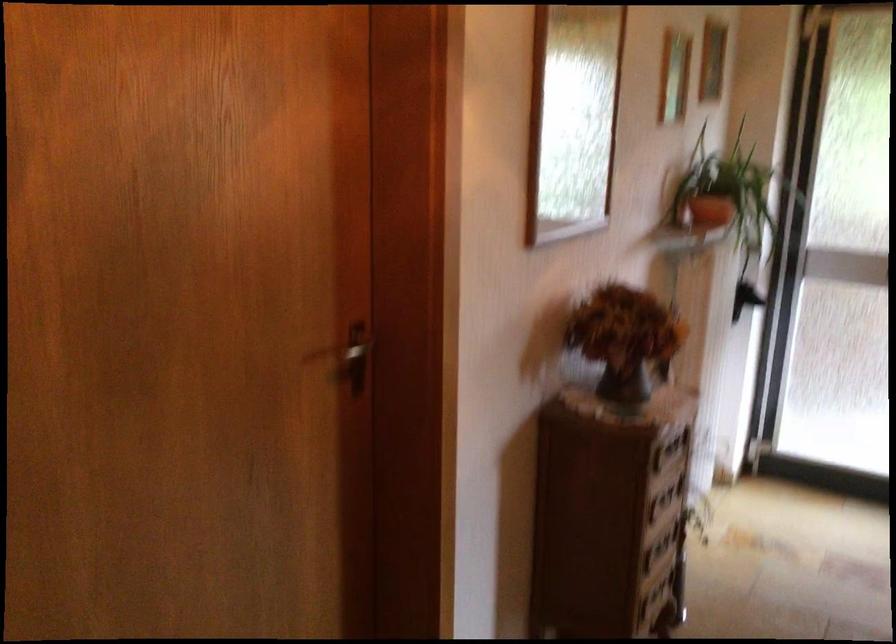
Image resolution: width=896 pixels, height=644 pixels. Describe the element at coordinates (355, 357) in the screenshot. I see `the metal door handle` at that location.